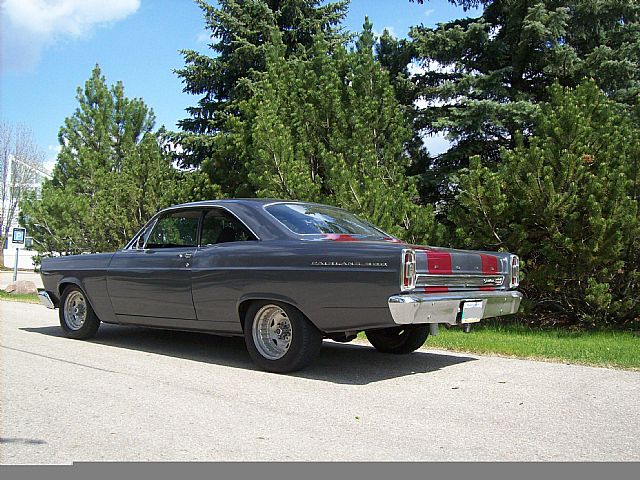
At what (x,y) coordinates should I click in order to perform the action: click on the left back window. Please return your answer as a coordinate pair (x, y). The height and width of the screenshot is (480, 640). Looking at the image, I should click on (230, 228).